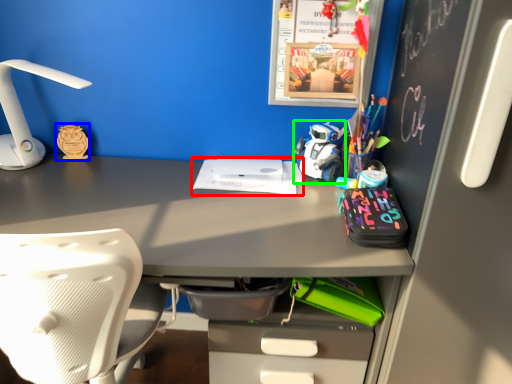
Question: Considering the real-world distances, which object is closest to office supplies (highlighted by a red box)? stationery (highlighted by a blue box) or toy (highlighted by a green box).

Choices:
 (A) stationery
 (B) toy

Answer: (B)